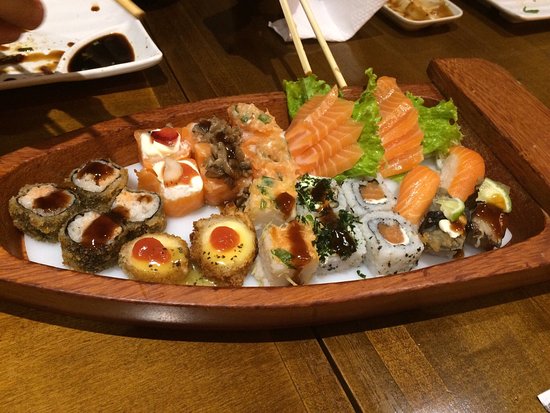
You are a GUI agent. You are given a task and a screenshot of the screen. Output one action in this format:
    pyautogui.click(x=<x>, y=<y>)
    Task: Click on the white plate
    
    Given the screenshot: What is the action you would take?
    pyautogui.click(x=34, y=45)